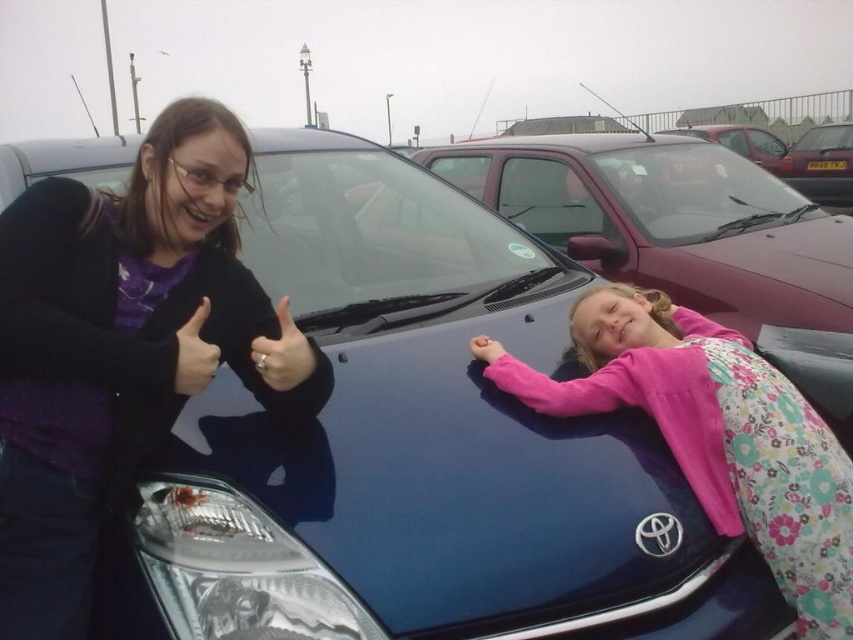
You are a delivery person who needs to park your vehicle in a space that can only accommodate cars narrower than the matte black ring at center. Based on the scene, can the metallic maroon car at right fit into this space?

The metallic maroon car at right is wider than the matte black ring at center, so it cannot fit into the parking space that requires cars narrower than the matte black ring at center.

You are standing in the parking lot and see the point marked at coordinates (821,163). Based on the scene description, can you identify what object this point is located on?

The point marked at coordinates (821,163) is located on the metallic maroon car at right, as stated in the objects description.

Looking at this image, you are a photographer trying to capture a closeup of the pink fabric hand at lower right without the matte black thumb at center blocking it. How can you adjust your position to achieve this?

Since the matte black thumb at center is in front of the pink fabric hand at lower right, you should move your camera position to the side so that the thumb is no longer directly blocking the hand. This could involve shifting left or right to find an angle where the hand is visible without obstruction.